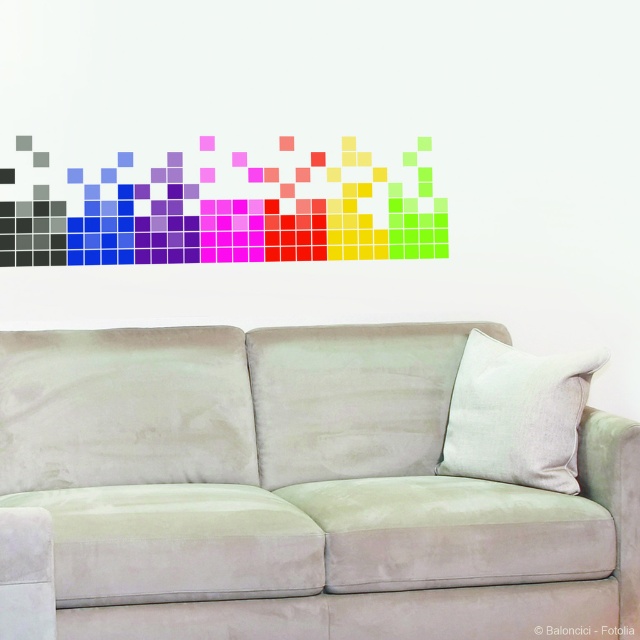
You are a delivery person who needs to place a 30 cm wide package between the suede couch at center and the white linen pillow at center. Can the package fit in the space between them?

The suede couch at center and white linen pillow at center are 35.22 centimeters apart. Since the package is 30 cm wide, it can fit in the space between them as 35.22 cm is wider than 30 cm.

You are arranging a living room and want to place a new lamp between the matte black pixel art at upper left and the white linen pillow at center. The lamp requires a minimum of 20 inches of space between them. Is there enough space?

The distance between the matte black pixel art at upper left and the white linen pillow at center is 33.35 inches, which is more than the required 20 inches. Therefore, there is sufficient space to place the lamp between them.

You are planning to place a new rectangular coffee table in front of the suede couch at center. The coffee table is 1.5 meters wide. To ensure it doesn not block the view of the matte black pixel art at upper left, which is on the wall behind the couch, should the table be placed closer to the left or the right side of the couch?

The suede couch at center might be wider than matte black pixel art at upper left, so placing the coffee table closer to the right side of the suede couch at center would leave the left side open, allowing an unobstructed view of the matte black pixel art at upper left on the wall.